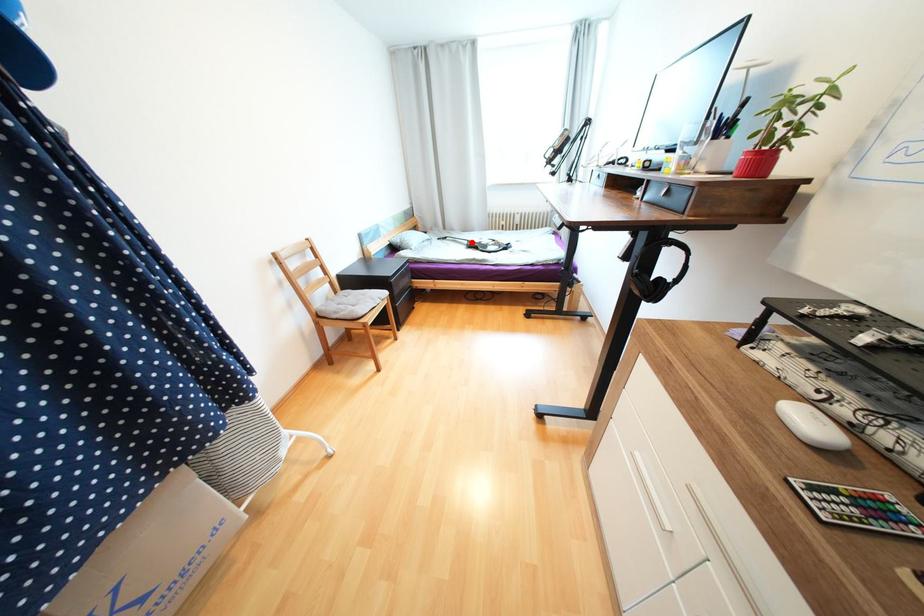
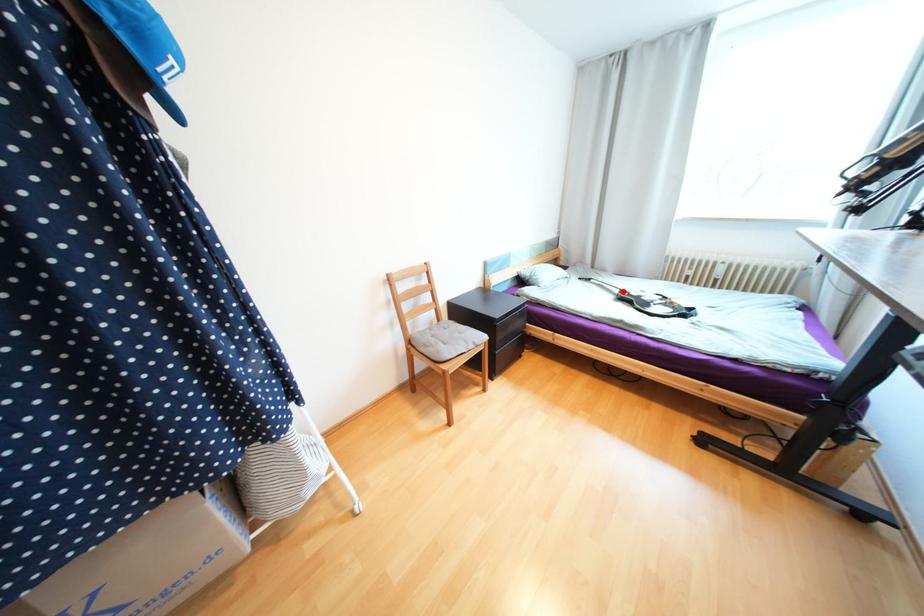
I am providing you with two images of the same scene from different viewpoints. A red point is marked on the first image and another point is marked on the second image. Does the point marked in image1 correspond to the same location as the one in image2?

Yes